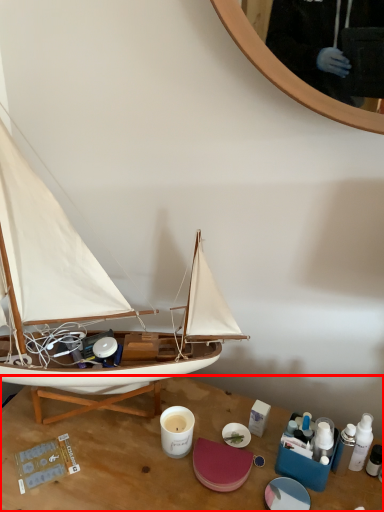
Question: Where is desk (annotated by the red box) located in relation to boat in the image?

Choices:
 (A) left
 (B) right

Answer: (B)